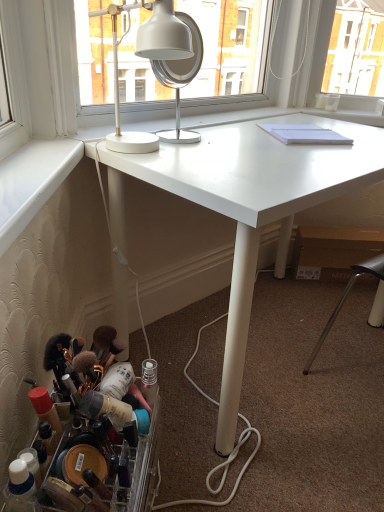
This screenshot has height=512, width=384. What do you see at coordinates (147, 58) in the screenshot? I see `white glossy desk lamp at upper center` at bounding box center [147, 58].

You are a GUI agent. You are given a task and a screenshot of the screen. Output one action in this format:
    pyautogui.click(x=<x>, y=<y>)
    Task: Click on the translucent plastic container at lower left
    The width and height of the screenshot is (384, 512).
    Given the screenshot: What is the action you would take?
    pyautogui.click(x=96, y=442)

The width and height of the screenshot is (384, 512). Identify the location of white glossy desk lamp at upper center. (147, 58).

Between point (124, 422) and point (279, 147), which one is positioned in front?

The point (124, 422) is in front.

From a real-world perspective, is translucent plastic container at lower left located beneath white matte desk at center?

Yes, from a real-world perspective, translucent plastic container at lower left is under white matte desk at center.

From the image's perspective, is translucent plastic container at lower left positioned above or below white matte desk at center?

Clearly, from the image's perspective, translucent plastic container at lower left is below white matte desk at center.

Can you confirm if translucent plastic container at lower left is shorter than white matte desk at center?

Yes, translucent plastic container at lower left is shorter than white matte desk at center.

Is white metallic mirror at upper center taller than translucent plastic container at lower left?

Yes, white metallic mirror at upper center is taller than translucent plastic container at lower left.

Is white metallic mirror at upper center beside translucent plastic container at lower left?

white metallic mirror at upper center is not next to translucent plastic container at lower left, and they're not touching.

Identify the location of mirror on the right of translucent plastic container at lower left. (180, 79).

Considering the sizes of objects white glossy desk lamp at upper center and white metallic mirror at upper center in the image provided, who is bigger, white glossy desk lamp at upper center or white metallic mirror at upper center?

With larger size is white glossy desk lamp at upper center.

From a real-world perspective, is white glossy desk lamp at upper center on top of white metallic mirror at upper center?

Yes, from a real-world perspective, white glossy desk lamp at upper center is on top of white metallic mirror at upper center.

Which object is closer to the camera taking this photo, white glossy desk lamp at upper center or white metallic mirror at upper center?

white glossy desk lamp at upper center is more forward.

The image size is (384, 512). I want to click on lamp positioned vertically above the white matte desk at center (from a real-world perspective), so click(x=147, y=58).

Based on the photo, from the image's perspective, does white glossy desk lamp at upper center appear lower than white matte desk at center?

Incorrect, from the image's perspective, white glossy desk lamp at upper center is higher than white matte desk at center.

Does white glossy desk lamp at upper center have a greater width compared to white matte desk at center?

In fact, white glossy desk lamp at upper center might be narrower than white matte desk at center.

Could you tell me if white matte desk at center is facing translucent plastic container at lower left?

No, white matte desk at center is not turned towards translucent plastic container at lower left.

Is white matte desk at center next to translucent plastic container at lower left?

white matte desk at center and translucent plastic container at lower left are clearly separated.

Between white matte desk at center and translucent plastic container at lower left, which one has larger width?

white matte desk at center is wider.

How much distance is there between white matte desk at center and white glossy desk lamp at upper center?

A distance of 12.40 inches exists between white matte desk at center and white glossy desk lamp at upper center.

In the scene shown: Is white matte desk at center in front of or behind white glossy desk lamp at upper center in the image?

Visually, white matte desk at center is located in front of white glossy desk lamp at upper center.

This screenshot has width=384, height=512. Find the location of `desk below the white glossy desk lamp at upper center (from the image's perspective)`. desk below the white glossy desk lamp at upper center (from the image's perspective) is located at coordinates (248, 205).

Between white matte desk at center and white glossy desk lamp at upper center, which one has larger width?

white matte desk at center.

Is white metallic mirror at upper center wider or thinner than white glossy desk lamp at upper center?

white metallic mirror at upper center is thinner than white glossy desk lamp at upper center.

Is point (154, 69) farther from camera compared to point (179, 25)?

Yes, it is.

From the picture: Is white metallic mirror at upper center beside white glossy desk lamp at upper center?

Absolutely, white metallic mirror at upper center is next to and touching white glossy desk lamp at upper center.

Identify the location of toiletry located underneath the white matte desk at center (from a real-world perspective). This screenshot has width=384, height=512. (96, 442).

I want to click on mirror on the right side of translucent plastic container at lower left, so [180, 79].

Considering their positions, is white matte desk at center positioned closer to white metallic mirror at upper center than white glossy desk lamp at upper center?

The object closer to white metallic mirror at upper center is white glossy desk lamp at upper center.

When comparing their distances from white matte desk at center, does white glossy desk lamp at upper center or white metallic mirror at upper center seem further?

Based on the image, white metallic mirror at upper center appears to be further to white matte desk at center.

Based on their spatial positions, is translucent plastic container at lower left or white metallic mirror at upper center further from white matte desk at center?

translucent plastic container at lower left lies further to white matte desk at center than the other object.

Which object lies nearer to the anchor point white metallic mirror at upper center, white glossy desk lamp at upper center or white matte desk at center?

Among the two, white glossy desk lamp at upper center is located nearer to white metallic mirror at upper center.

Based on their spatial positions, is white matte desk at center or translucent plastic container at lower left further from white metallic mirror at upper center?

Among the two, translucent plastic container at lower left is located further to white metallic mirror at upper center.

When comparing their distances from translucent plastic container at lower left, does white glossy desk lamp at upper center or white matte desk at center seem closer?

white matte desk at center lies closer to translucent plastic container at lower left than the other object.

From the image, which object appears to be farther from white metallic mirror at upper center, translucent plastic container at lower left or white matte desk at center?

Among the two, translucent plastic container at lower left is located further to white metallic mirror at upper center.

When comparing their distances from translucent plastic container at lower left, does white matte desk at center or white metallic mirror at upper center seem closer?

white matte desk at center is closer to translucent plastic container at lower left.

Find the location of a particular element. lamp between white metallic mirror at upper center and translucent plastic container at lower left from top to bottom is located at coordinates (147, 58).

Locate an element on the screen. The height and width of the screenshot is (512, 384). desk that lies between white metallic mirror at upper center and translucent plastic container at lower left from top to bottom is located at coordinates point(248,205).

Locate an element on the screen. This screenshot has height=512, width=384. desk between white glossy desk lamp at upper center and translucent plastic container at lower left vertically is located at coordinates (248, 205).

Where is `lamp between white metallic mirror at upper center and white matte desk at center from top to bottom`? The height and width of the screenshot is (512, 384). lamp between white metallic mirror at upper center and white matte desk at center from top to bottom is located at coordinates (147, 58).